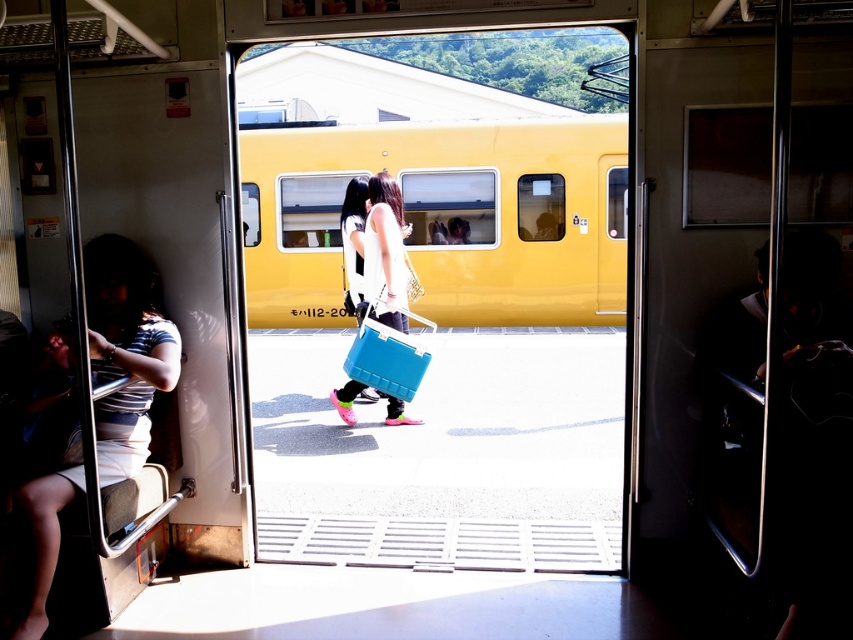
Between yellow matte train at center and striped fabric shirt at left, which one appears on the right side from the viewer's perspective?

From the viewer's perspective, yellow matte train at center appears more on the right side.

At what (x,y) coordinates should I click in order to perform the action: click on yellow matte train at center. Please return your answer as a coordinate pair (x, y). The image size is (853, 640). Looking at the image, I should click on (445, 218).

Does point (335, 260) come farther from viewer compared to point (155, 305)?

Yes, point (335, 260) is behind point (155, 305).

The width and height of the screenshot is (853, 640). I want to click on yellow matte train at center, so click(x=445, y=218).

Is point (102, 456) behind point (334, 401)?

No, it is in front of (334, 401).

Which is behind, point (32, 593) or point (381, 312)?

Positioned behind is point (381, 312).

The width and height of the screenshot is (853, 640). I want to click on striped fabric shirt at left, so click(x=125, y=349).

Which is more to the right, yellow matte train at center or matte white shirt at center?

Positioned to the right is yellow matte train at center.

Who is higher up, yellow matte train at center or matte white shirt at center?

Positioned higher is yellow matte train at center.

Locate an element on the screen. This screenshot has width=853, height=640. yellow matte train at center is located at coordinates (445, 218).

Identify the location of yellow matte train at center. (445, 218).